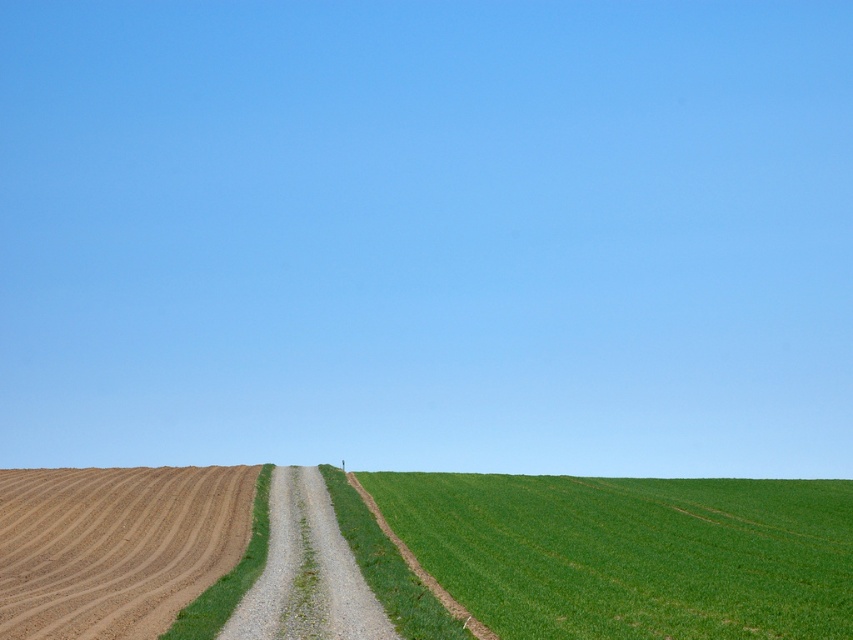
Question: Which point appears farthest from the camera in this image?

Choices:
 (A) (709, 529)
 (B) (192, 598)

Answer: (A)

Question: Is green grass at lower right bigger than brown gravel road at lower left?

Choices:
 (A) yes
 (B) no

Answer: (A)

Question: Which object appears farthest from the camera in this image?

Choices:
 (A) brown gravel road at lower left
 (B) green grass at lower right

Answer: (B)

Question: Is green grass at lower right to the left of brown gravel road at lower left from the viewer's perspective?

Choices:
 (A) no
 (B) yes

Answer: (A)

Question: Which point is closer to the camera?

Choices:
 (A) (16, 484)
 (B) (583, 477)
 (C) (335, 522)

Answer: (C)

Question: Is brown gravel road at lower left above gravelly dirt path at center?

Choices:
 (A) no
 (B) yes

Answer: (A)